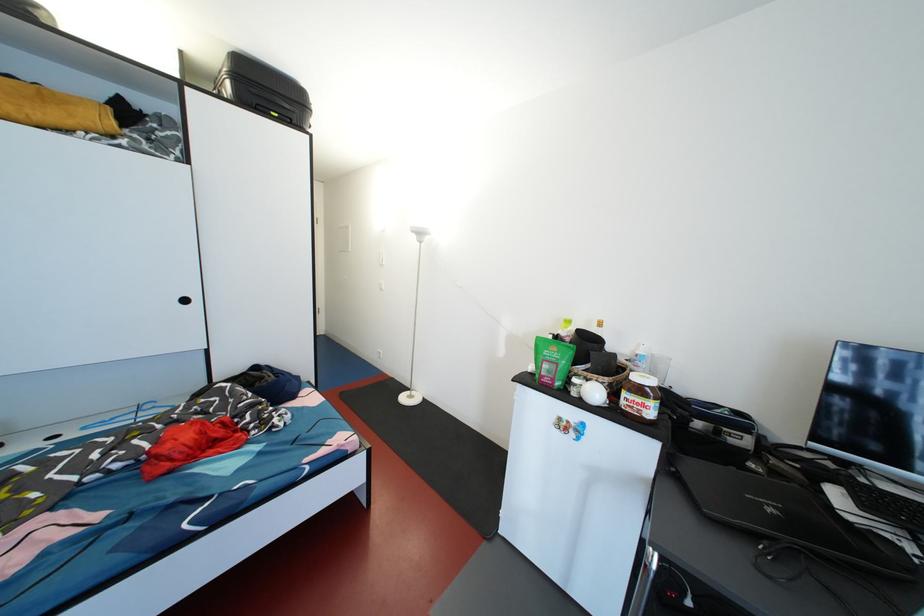
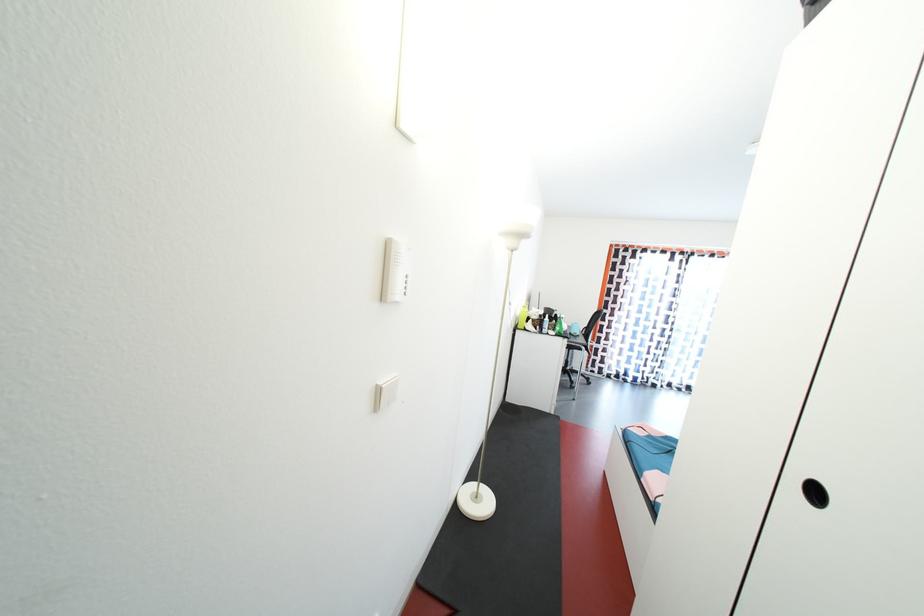
Question: I am providing you with two images of the same scene from different viewpoints. After the viewpoint changes to image2, which objects are now occluded?

Choices:
 (A) closed black laptop
 (B) glass kettle handle
 (C) white light switch
 (D) recessed cabinet handle

Answer: (A)